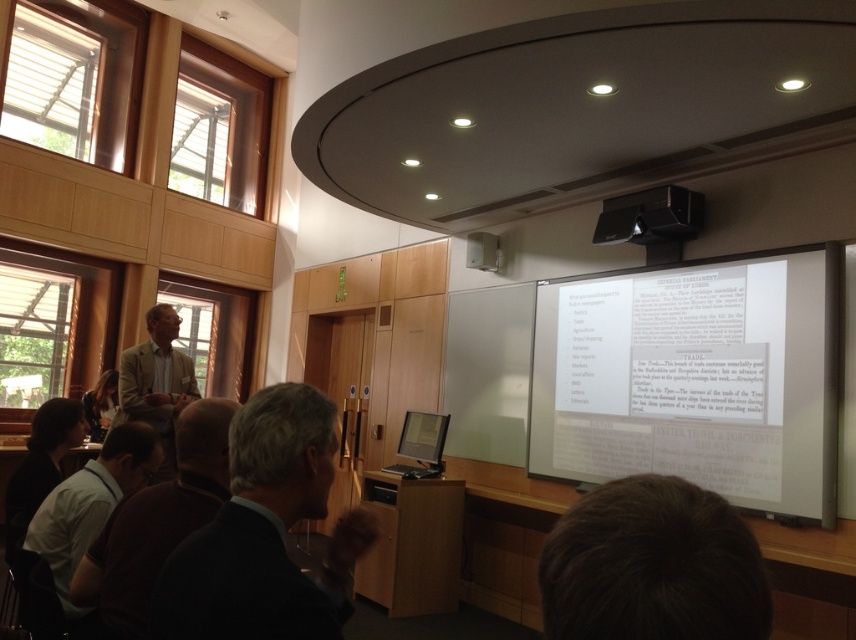
You are an attendee in the conference room and want to see both the dark brown shirt at lower left and the matte black monitor at center. Which one is positioned higher in the image?

The dark brown shirt at lower left is located above the matte black monitor at center, so it is positioned higher in the image.

You are a photographer in the conference room and want to capture a photo of the dark brown shirt at lower left and the matte black monitor at center. Which object is taller in the image?

The dark brown shirt at lower left is taller than the matte black monitor at center.